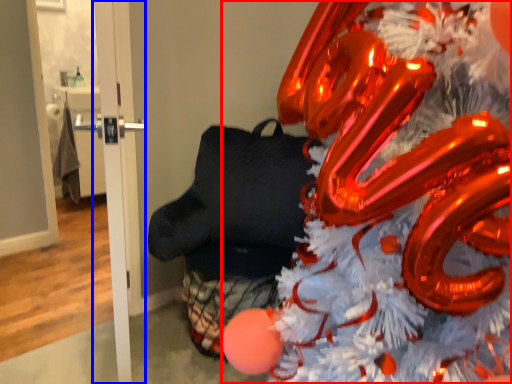
Question: Which point is further to the camera, christmas tree (highlighted by a red box) or door (highlighted by a blue box)?

Choices:
 (A) christmas tree
 (B) door

Answer: (B)